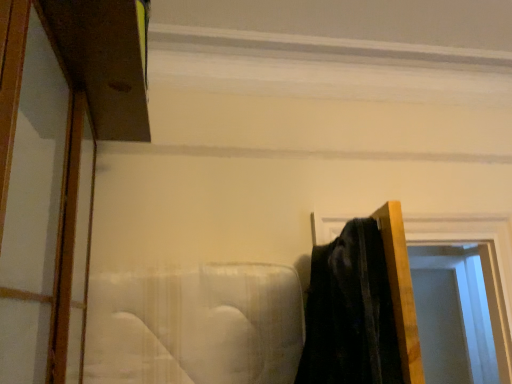
Question: Can you confirm if transparent glass door at right is positioned to the right of wooden door frame at right?

Choices:
 (A) no
 (B) yes

Answer: (B)

Question: Is transparent glass door at right aimed at wooden door frame at right?

Choices:
 (A) yes
 (B) no

Answer: (B)

Question: Considering the relative sizes of transparent glass door at right and wooden door frame at right in the image provided, is transparent glass door at right wider than wooden door frame at right?

Choices:
 (A) yes
 (B) no

Answer: (B)

Question: Can you confirm if transparent glass door at right is smaller than wooden door frame at right?

Choices:
 (A) no
 (B) yes

Answer: (B)

Question: Can you confirm if transparent glass door at right is bigger than wooden door frame at right?

Choices:
 (A) no
 (B) yes

Answer: (A)

Question: Can you confirm if transparent glass door at right is taller than wooden door frame at right?

Choices:
 (A) no
 (B) yes

Answer: (B)

Question: Can you confirm if wooden door frame at right is bigger than transparent glass door at right?

Choices:
 (A) yes
 (B) no

Answer: (A)

Question: From a real-world perspective, is wooden door frame at right physically below transparent glass door at right?

Choices:
 (A) yes
 (B) no

Answer: (B)

Question: Is wooden door frame at right positioned behind transparent glass door at right?

Choices:
 (A) no
 (B) yes

Answer: (A)

Question: Is wooden door frame at right not inside transparent glass door at right?

Choices:
 (A) yes
 (B) no

Answer: (A)

Question: Can you confirm if wooden door frame at right is wider than transparent glass door at right?

Choices:
 (A) no
 (B) yes

Answer: (B)

Question: Does wooden door frame at right appear on the right side of transparent glass door at right?

Choices:
 (A) no
 (B) yes

Answer: (A)

Question: Is point (458, 372) positioned closer to the camera than point (437, 231)?

Choices:
 (A) farther
 (B) closer

Answer: (A)